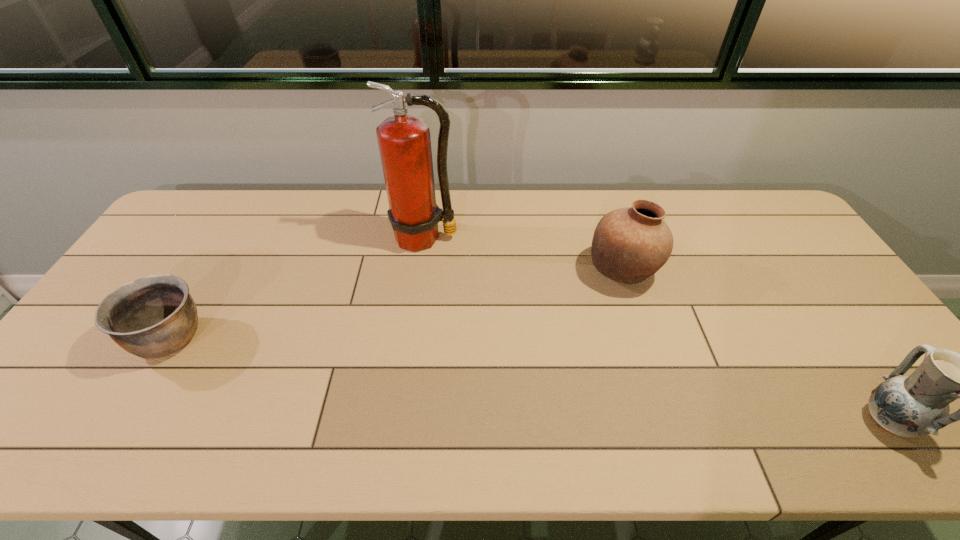
Find the location of a particular element. the third object from right to left is located at coordinates (404, 141).

Locate an element on the screen. Image resolution: width=960 pixels, height=540 pixels. the tallest object is located at coordinates (404, 141).

This screenshot has height=540, width=960. What are the coordinates of `the farthest pottery` in the screenshot? It's located at (630, 244).

Image resolution: width=960 pixels, height=540 pixels. Identify the location of the second object from right to left. (630, 244).

In order to click on the nearest object in this screenshot , I will do `click(917, 405)`.

Locate an element on the screen. Image resolution: width=960 pixels, height=540 pixels. the rightmost object is located at coordinates (917, 405).

Identify the location of the second nearest pottery. This screenshot has width=960, height=540. (155, 316).

The image size is (960, 540). Find the location of `the leftmost pottery`. the leftmost pottery is located at coordinates (155, 316).

At what (x,y) coordinates should I click in order to perform the action: click on blank area located 0.200m at the nozzle of the tallest object. Please return your answer as a coordinate pair (x, y). This screenshot has width=960, height=540. Looking at the image, I should click on (416, 304).

You are a GUI agent. You are given a task and a screenshot of the screen. Output one action in this format:
    pyautogui.click(x=<x>, y=<y>)
    Task: Click on the free space located 0.290m on the back of the farthest pottery
    This screenshot has width=960, height=540.
    Given the screenshot: What is the action you would take?
    pyautogui.click(x=597, y=193)